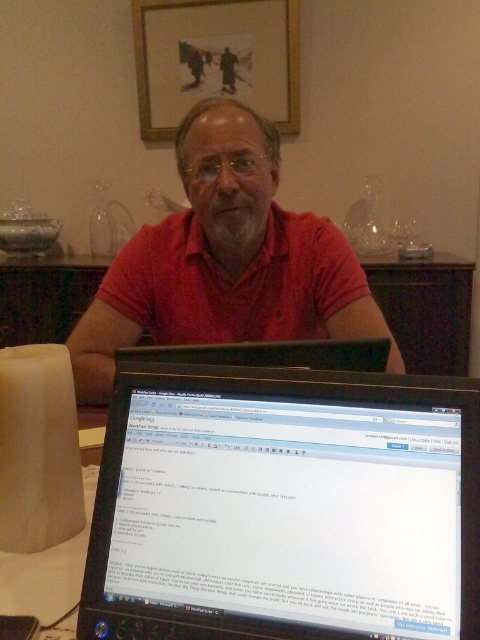
Which is behind, point (350, 419) or point (277, 1)?

Positioned behind is point (277, 1).

Between black glossy laptop at lower center and wooden framed picture at upper center, which one is positioned lower?

black glossy laptop at lower center

This screenshot has height=640, width=480. Describe the element at coordinates (285, 506) in the screenshot. I see `black glossy laptop at lower center` at that location.

This screenshot has height=640, width=480. Find the location of `black glossy laptop at lower center`. black glossy laptop at lower center is located at coordinates (285, 506).

Is matte red shirt at center positioned before wooden framed picture at upper center?

Yes, it is in front of wooden framed picture at upper center.

What do you see at coordinates (226, 260) in the screenshot?
I see `matte red shirt at center` at bounding box center [226, 260].

Find the location of `matte red shirt at center`. matte red shirt at center is located at coordinates (x=226, y=260).

Is black glossy laptop at lower center above matte red shirt at center?

Incorrect, black glossy laptop at lower center is not positioned above matte red shirt at center.

Can you confirm if black glossy laptop at lower center is positioned to the left of matte red shirt at center?

No, black glossy laptop at lower center is not to the left of matte red shirt at center.

Does point (109, 419) lie behind point (269, 195)?

No, (109, 419) is closer to viewer.

Find the location of `black glossy laptop at lower center`. black glossy laptop at lower center is located at coordinates (285, 506).